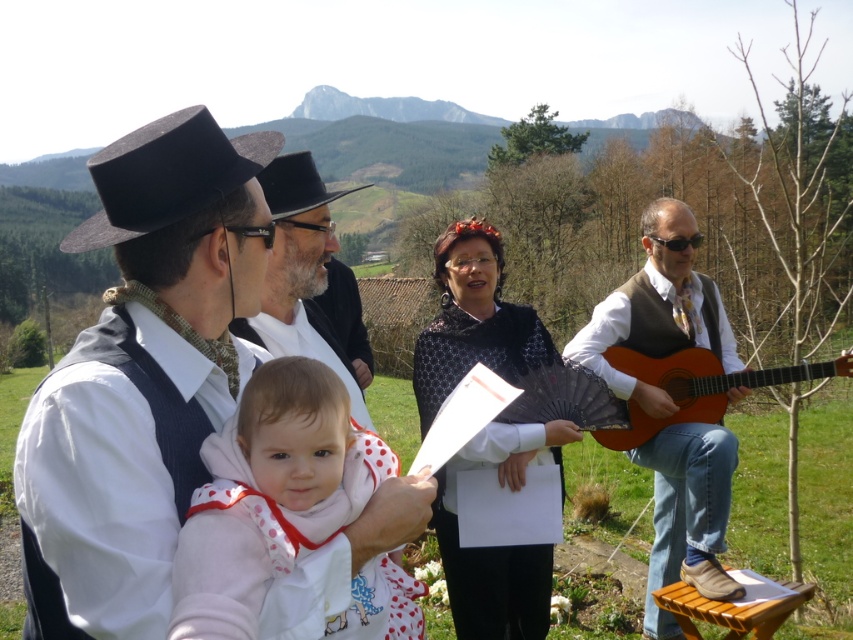
You are a photographer setting up a tripod to capture the scene. The tripod requires a minimum of 4 feet of space between the black lace shawl at center and the black felt dress hat at left to avoid obstruction. Can you place the tripod between them without blocking the view?

The black lace shawl at center and black felt dress hat at left are 5.82 feet apart, which is more than the required 4 feet. Therefore, you can safely place the tripod between them without blocking the view.